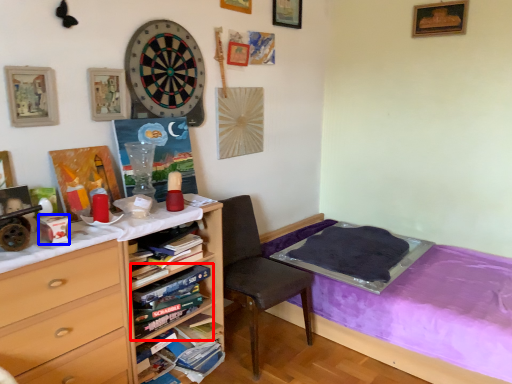
Question: Which object is further to the camera taking this photo, book (highlighted by a red box) or box (highlighted by a blue box)?

Choices:
 (A) book
 (B) box

Answer: (A)